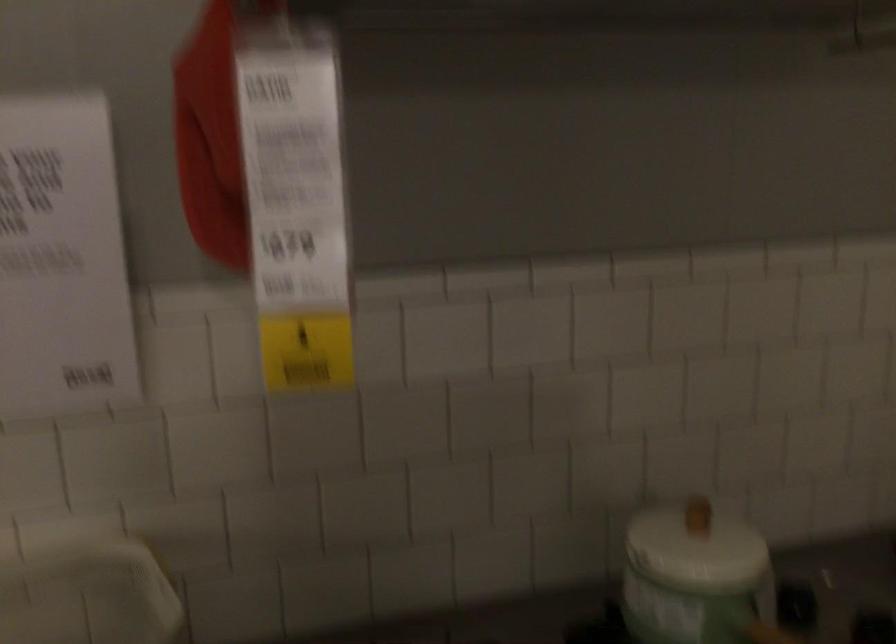
This screenshot has width=896, height=644. Describe the element at coordinates (695, 547) in the screenshot. I see `the white canister lid` at that location.